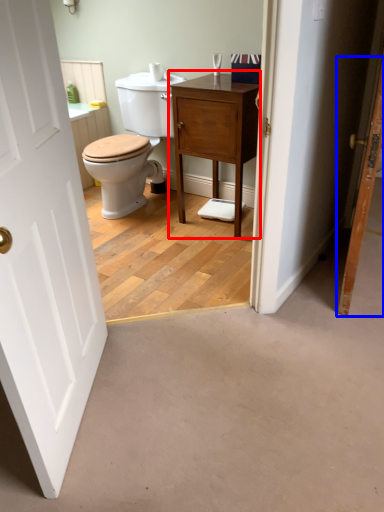
Question: Which object appears closest to the camera in this image, nightstand (highlighted by a red box) or door (highlighted by a blue box)?

Choices:
 (A) nightstand
 (B) door

Answer: (B)